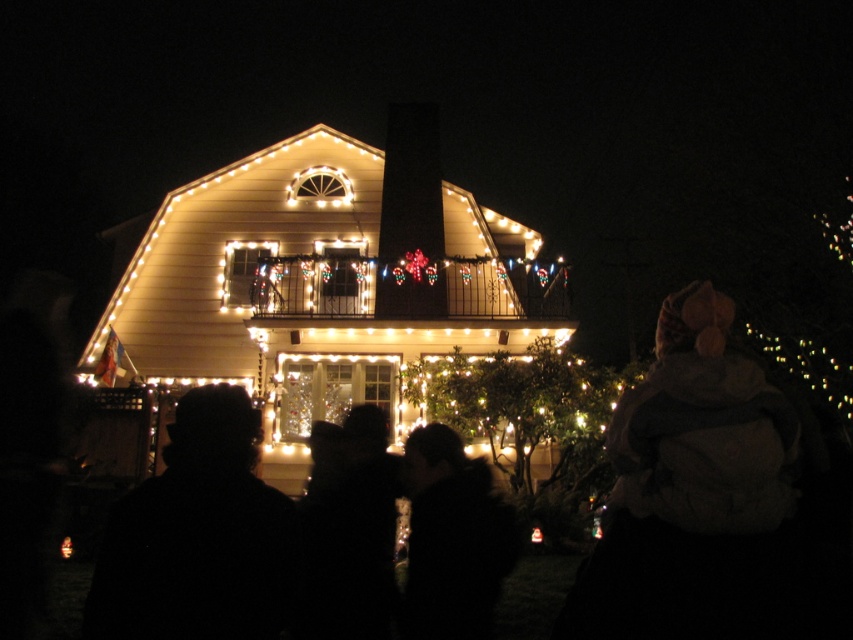
You are standing in front of the festive house and see the black fuzzy hat at center and the silhouette of person at center. Which object is positioned higher in the scene?

The black fuzzy hat at center is located above the silhouette of person at center, so it is positioned higher in the scene.

You are a guest at the festive house and notice both the black fuzzy hat at center and the silhouette of person at center. Which object appears bigger in the image?

The black fuzzy hat at center appears larger in size than the silhouette of person at center in the image.